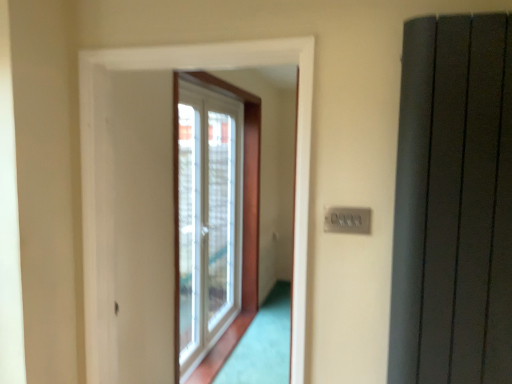
Question: Should I look upward or downward to see white plastic window at center?

Choices:
 (A) down
 (B) up

Answer: (A)

Question: Is white plastic window at center at the back of gray plastic switch at upper right?

Choices:
 (A) yes
 (B) no

Answer: (B)

Question: Is gray plastic switch at upper right to the left of white plastic window at center from the viewer's perspective?

Choices:
 (A) no
 (B) yes

Answer: (A)

Question: Is gray plastic switch at upper right smaller than white plastic window at center?

Choices:
 (A) yes
 (B) no

Answer: (A)

Question: Is gray plastic switch at upper right further to camera compared to white plastic window at center?

Choices:
 (A) no
 (B) yes

Answer: (A)

Question: Considering the relative sizes of gray plastic switch at upper right and white plastic window at center in the image provided, is gray plastic switch at upper right thinner than white plastic window at center?

Choices:
 (A) no
 (B) yes

Answer: (B)

Question: Is gray plastic switch at upper right closer to the viewer compared to white plastic window at center?

Choices:
 (A) yes
 (B) no

Answer: (A)

Question: Does gray plastic switch at upper right have a lesser height compared to matte gray radiator at right?

Choices:
 (A) yes
 (B) no

Answer: (A)

Question: Is the position of gray plastic switch at upper right less distant than that of matte gray radiator at right?

Choices:
 (A) yes
 (B) no

Answer: (B)

Question: Considering the relative positions of gray plastic switch at upper right and matte gray radiator at right in the image provided, is gray plastic switch at upper right to the right of matte gray radiator at right from the viewer's perspective?

Choices:
 (A) yes
 (B) no

Answer: (B)

Question: Could you tell me if gray plastic switch at upper right is facing matte gray radiator at right?

Choices:
 (A) yes
 (B) no

Answer: (B)

Question: Is gray plastic switch at upper right at the left side of matte gray radiator at right?

Choices:
 (A) no
 (B) yes

Answer: (B)

Question: Is matte gray radiator at right located within gray plastic switch at upper right?

Choices:
 (A) yes
 (B) no

Answer: (B)

Question: From a real-world perspective, is matte gray radiator at right located beneath gray plastic switch at upper right?

Choices:
 (A) yes
 (B) no

Answer: (B)